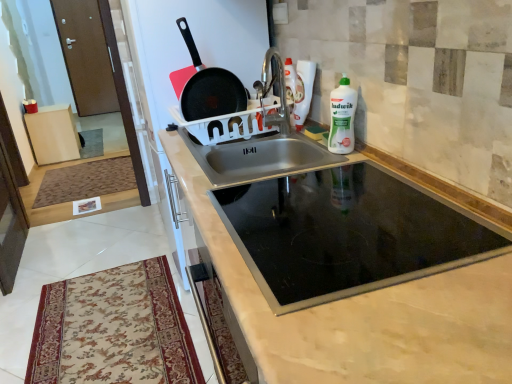
Question: From the image's perspective, is black glass cooktop at center positioned above or below brown wooden door at upper left?

Choices:
 (A) above
 (B) below

Answer: (B)

Question: Is black glass cooktop at center inside the boundaries of brown wooden door at upper left, or outside?

Choices:
 (A) inside
 (B) outside

Answer: (B)

Question: Estimate the real-world distances between objects in this image. Which object is farther from the white plastic bottle at upper right?

Choices:
 (A) black matte frying pan at upper center
 (B) black glass cooktop at center
 (C) brown wooden door at upper left
 (D) beige floral rug at lower left, the 2th mat positioned from the left
 (E) brown textured mat at lower left, positioned as the 2th mat in front-to-back order

Answer: (C)

Question: Estimate the real-world distances between objects in this image. Which object is closer to the brown wooden door at upper left?

Choices:
 (A) brown textured mat at lower left, the 1th mat from the left
 (B) black glass cooktop at center
 (C) black matte frying pan at upper center
 (D) beige floral rug at lower left, placed as the first mat when sorted from bottom to top
 (E) white plastic bottle at upper right

Answer: (A)